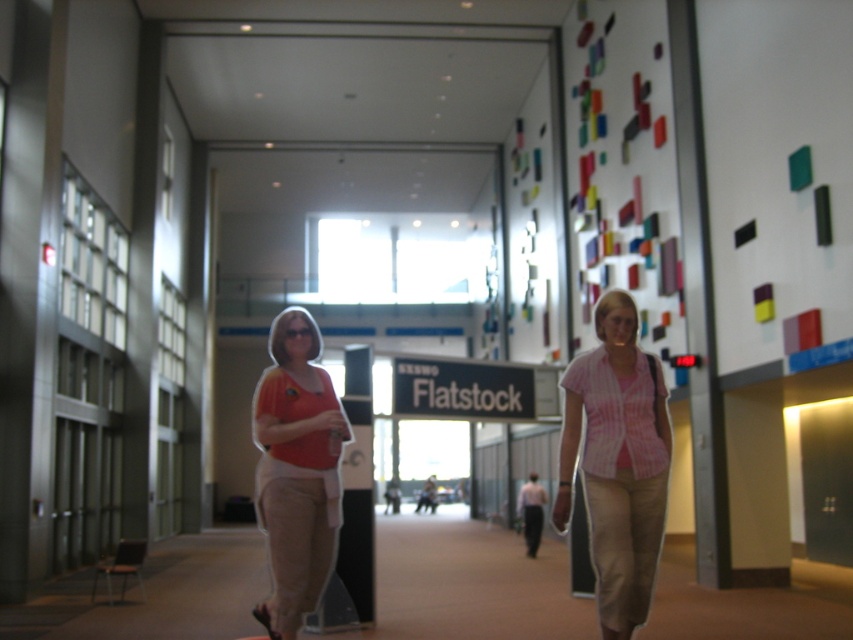
The height and width of the screenshot is (640, 853). In order to click on pink striped shirt at center in this screenshot , I will do `click(618, 461)`.

Who is lower down, pink striped shirt at center or matte orange shirt at center?

Positioned lower is pink striped shirt at center.

Who is more forward, (610, 477) or (274, 563)?

Positioned in front is point (274, 563).

Identify the location of pink striped shirt at center. The width and height of the screenshot is (853, 640). (618, 461).